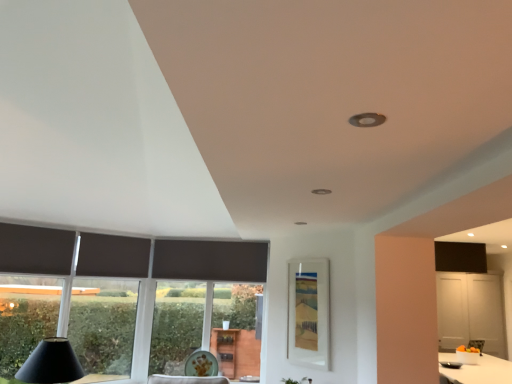
Question: From a real-world perspective, is transparent glass window at left over matte glass window screen at center?

Choices:
 (A) no
 (B) yes

Answer: (A)

Question: Would you say matte glass window screen at center is part of transparent glass window at left's contents?

Choices:
 (A) no
 (B) yes

Answer: (A)

Question: Is the depth of transparent glass window at left greater than that of matte glass window screen at center?

Choices:
 (A) no
 (B) yes

Answer: (B)

Question: From the image's perspective, does transparent glass window at left appear lower than matte glass window screen at center?

Choices:
 (A) no
 (B) yes

Answer: (B)

Question: Is transparent glass window at left taller than matte glass window screen at center?

Choices:
 (A) yes
 (B) no

Answer: (A)

Question: From the image's perspective, relative to dark matte curtain at left, which is the second curtain in front-to-back order, is dark matte curtain at left, the 1th curtain positioned from the left, above or below?

Choices:
 (A) above
 (B) below

Answer: (A)

Question: In the image, is dark matte curtain at left, the 1th curtain positioned from the left, positioned in front of or behind dark matte curtain at left, which appears as the first curtain when viewed from the back?

Choices:
 (A) behind
 (B) front

Answer: (B)

Question: Choose the correct answer: Is dark matte curtain at left, which is the first curtain in front-to-back order, inside dark matte curtain at left, marked as the 2th curtain in a left-to-right arrangement, or outside it?

Choices:
 (A) inside
 (B) outside

Answer: (B)

Question: Is dark matte curtain at left, arranged as the second curtain when viewed from the back, wider or thinner than dark matte curtain at left, which is the second curtain in front-to-back order?

Choices:
 (A) wide
 (B) thin

Answer: (B)

Question: Is point (3, 249) closer or farther from the camera than point (192, 354)?

Choices:
 (A) farther
 (B) closer

Answer: (B)

Question: In terms of width, does dark matte curtain at left, arranged as the second curtain when viewed from the back, look wider or thinner when compared to porcelain plate at lower center?

Choices:
 (A) wide
 (B) thin

Answer: (B)

Question: In terms of height, does dark matte curtain at left, which is the first curtain in front-to-back order, look taller or shorter compared to porcelain plate at lower center?

Choices:
 (A) short
 (B) tall

Answer: (B)

Question: From a real-world perspective, is dark matte curtain at left, which is the first curtain in front-to-back order, positioned above or below porcelain plate at lower center?

Choices:
 (A) above
 (B) below

Answer: (A)

Question: In the image, is matte glass window screen at center on the left side or the right side of dark matte curtain at left, the 1th curtain positioned from the left?

Choices:
 (A) right
 (B) left

Answer: (A)

Question: Is point (292, 294) closer or farther from the camera than point (68, 266)?

Choices:
 (A) closer
 (B) farther

Answer: (B)